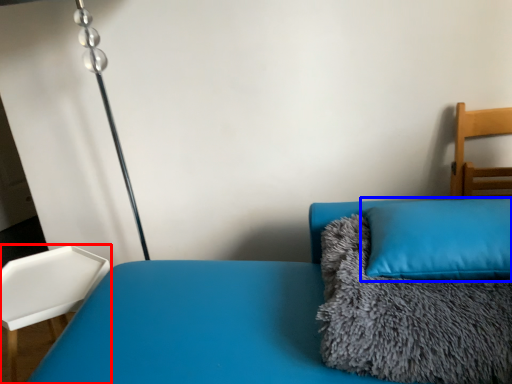
Question: Which of the following is the closest to the observer, furniture (highlighted by a red box) or pillow (highlighted by a blue box)?

Choices:
 (A) furniture
 (B) pillow

Answer: (B)